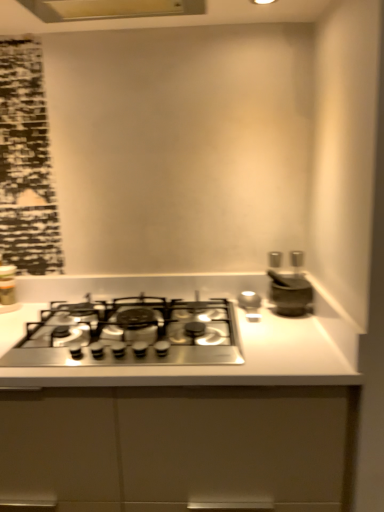
Question: Does metallic silver canister at left turn towards matte white exhaust hood at upper center?

Choices:
 (A) no
 (B) yes

Answer: (A)

Question: Considering the relative sizes of metallic silver canister at left and matte white exhaust hood at upper center in the image provided, is metallic silver canister at left smaller than matte white exhaust hood at upper center?

Choices:
 (A) yes
 (B) no

Answer: (A)

Question: Is metallic silver canister at left with matte white exhaust hood at upper center?

Choices:
 (A) yes
 (B) no

Answer: (B)

Question: Is metallic silver canister at left looking in the opposite direction of matte white exhaust hood at upper center?

Choices:
 (A) no
 (B) yes

Answer: (A)

Question: Is metallic silver canister at left not inside matte white exhaust hood at upper center?

Choices:
 (A) no
 (B) yes

Answer: (B)

Question: Can you confirm if metallic silver canister at left is wider than matte white exhaust hood at upper center?

Choices:
 (A) yes
 (B) no

Answer: (B)

Question: From the image's perspective, is matte white exhaust hood at upper center located above satin silver mortar at right?

Choices:
 (A) yes
 (B) no

Answer: (A)

Question: From the image's perspective, is matte white exhaust hood at upper center located beneath satin silver mortar at right?

Choices:
 (A) no
 (B) yes

Answer: (A)

Question: Does matte white exhaust hood at upper center touch satin silver mortar at right?

Choices:
 (A) yes
 (B) no

Answer: (B)

Question: Is matte white exhaust hood at upper center at the right side of satin silver mortar at right?

Choices:
 (A) yes
 (B) no

Answer: (B)

Question: Is satin silver mortar at right a part of matte white exhaust hood at upper center?

Choices:
 (A) no
 (B) yes

Answer: (A)

Question: Is matte white exhaust hood at upper center wider than satin silver mortar at right?

Choices:
 (A) yes
 (B) no

Answer: (A)

Question: Is satin silver mortar at right oriented away from stainless steel gas stove at center?

Choices:
 (A) yes
 (B) no

Answer: (B)